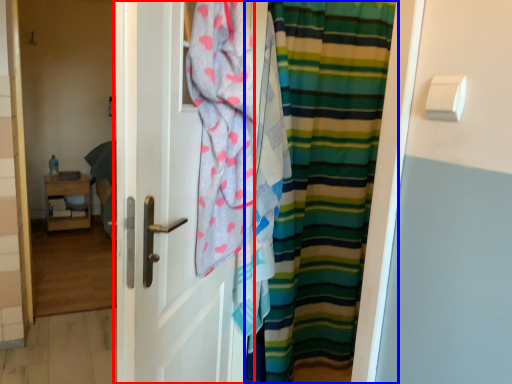
Question: Which of the following is the closest to the observer, door (highlighted by a red box) or curtain (highlighted by a blue box)?

Choices:
 (A) door
 (B) curtain

Answer: (A)